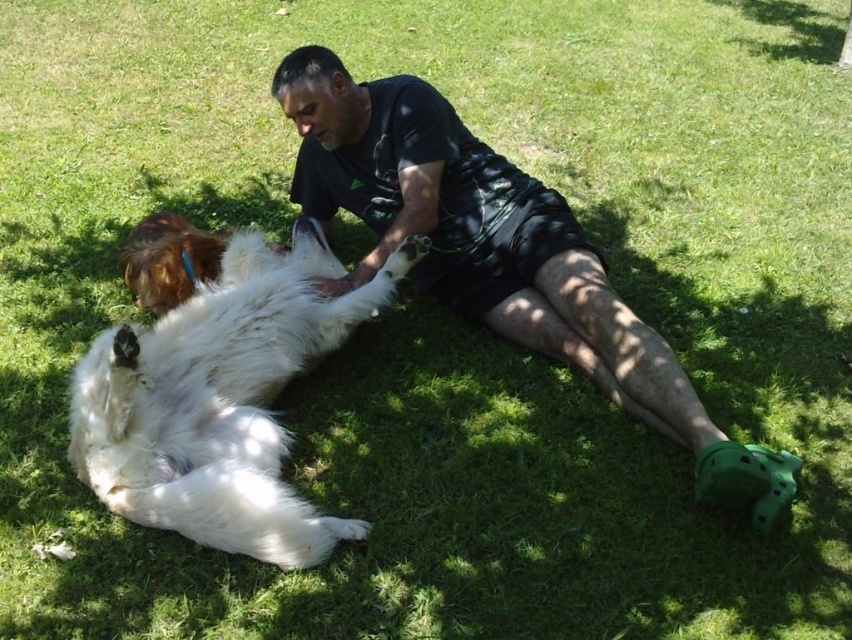
Question: Which of the following is the closest to the observer?

Choices:
 (A) (136, 493)
 (B) (435, 141)

Answer: (A)

Question: Does black matte shorts at center have a smaller size compared to white fluffy dog at center?

Choices:
 (A) yes
 (B) no

Answer: (B)

Question: Among these points, which one is farthest from the camera?

Choices:
 (A) [393, 86]
 (B) [327, 515]

Answer: (A)

Question: Does black matte shorts at center have a greater width compared to white fluffy dog at center?

Choices:
 (A) no
 (B) yes

Answer: (B)

Question: Does black matte shorts at center appear on the right side of white fluffy dog at center?

Choices:
 (A) yes
 (B) no

Answer: (A)